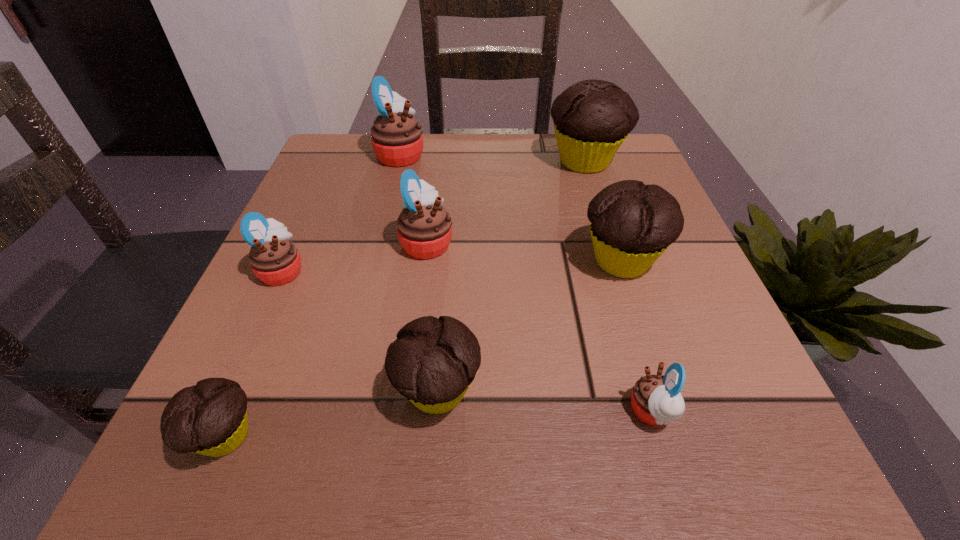
Find the location of a particular element. Image resolution: width=960 pixels, height=540 pixels. vacant region between the biggest pink muffin and the second chocolate muffin from left to right is located at coordinates (420, 273).

Locate an element on the screen. This screenshot has height=540, width=960. empty location between the biggest chocolate muffin and the biggest pink muffin is located at coordinates (492, 158).

Where is `unoccupied area between the smallest chocolate muffin and the second biggest pink muffin`? Image resolution: width=960 pixels, height=540 pixels. unoccupied area between the smallest chocolate muffin and the second biggest pink muffin is located at coordinates (325, 339).

The height and width of the screenshot is (540, 960). Find the location of `unoccupied area between the second biggest pink muffin and the biggest chocolate muffin`. unoccupied area between the second biggest pink muffin and the biggest chocolate muffin is located at coordinates (506, 202).

Identify the location of vacant space that is in between the third chocolate muffin from right to left and the smallest chocolate muffin. This screenshot has height=540, width=960. (331, 414).

The image size is (960, 540). Find the location of `empty space that is in between the second farthest chocolate muffin and the third biggest chocolate muffin`. empty space that is in between the second farthest chocolate muffin and the third biggest chocolate muffin is located at coordinates (530, 326).

The height and width of the screenshot is (540, 960). Identify the location of free spot between the second biggest pink muffin and the second farthest chocolate muffin. (524, 251).

At what (x,y) coordinates should I click in order to perform the action: click on vacant area that lies between the leftmost chocolate muffin and the farthest chocolate muffin. Please return your answer as a coordinate pair (x, y). Looking at the image, I should click on (405, 299).

This screenshot has width=960, height=540. I want to click on empty space between the third smallest chocolate muffin and the biggest pink muffin, so tap(511, 207).

Point out which object is positioned as the nearest to the third biggest pink muffin. Please provide its 2D coordinates. Your answer should be formatted as a tuple, i.e. [(x, y)], where the tuple contains the x and y coordinates of a point satisfying the conditions above.

[(424, 227)]